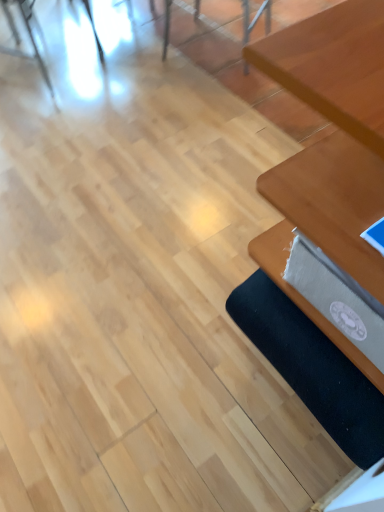
Question: Is wooden chair at upper center, which ranks as the first chair in right-to-left order, closer to camera compared to metallic silver chair at upper left, which is the 1th chair from left to right?

Choices:
 (A) yes
 (B) no

Answer: (B)

Question: Does wooden chair at upper center, which is counted as the 2th chair, starting from the left, have a lesser width compared to metallic silver chair at upper left, which is the second chair from right to left?

Choices:
 (A) yes
 (B) no

Answer: (B)

Question: Could metallic silver chair at upper left, which is the second chair from right to left, be considered to be inside wooden chair at upper center, which is counted as the 2th chair, starting from the left?

Choices:
 (A) no
 (B) yes

Answer: (A)

Question: From the image's perspective, is wooden chair at upper center, which ranks as the first chair in right-to-left order, located beneath metallic silver chair at upper left, which is the second chair from right to left?

Choices:
 (A) yes
 (B) no

Answer: (B)

Question: Is wooden chair at upper center, which ranks as the first chair in right-to-left order, at the left side of metallic silver chair at upper left, which is the 1th chair from left to right?

Choices:
 (A) no
 (B) yes

Answer: (A)

Question: From the image's perspective, is metallic silver chair at upper left, which is the second chair from right to left, above or below black fabric yoga mat at lower right?

Choices:
 (A) above
 (B) below

Answer: (A)

Question: Relative to black fabric yoga mat at lower right, is metallic silver chair at upper left, which is the 1th chair from left to right, in front or behind?

Choices:
 (A) behind
 (B) front

Answer: (A)

Question: Does point (28, 16) appear closer or farther from the camera than point (337, 378)?

Choices:
 (A) closer
 (B) farther

Answer: (B)

Question: Which is correct: metallic silver chair at upper left, which is the 1th chair from left to right, is inside black fabric yoga mat at lower right, or outside of it?

Choices:
 (A) inside
 (B) outside

Answer: (B)

Question: Is wooden chair at upper center, which is counted as the 2th chair, starting from the left, situated inside wooden table at right or outside?

Choices:
 (A) outside
 (B) inside

Answer: (A)

Question: Looking at the image, does wooden chair at upper center, which ranks as the first chair in right-to-left order, seem bigger or smaller compared to wooden table at right?

Choices:
 (A) big
 (B) small

Answer: (B)

Question: From a real-world perspective, relative to wooden table at right, is wooden chair at upper center, which ranks as the first chair in right-to-left order, vertically above or below?

Choices:
 (A) above
 (B) below

Answer: (B)

Question: Considering the positions of point (163, 16) and point (359, 364), is point (163, 16) closer or farther from the camera than point (359, 364)?

Choices:
 (A) farther
 (B) closer

Answer: (A)

Question: From the image's perspective, is wooden table at right located above or below metallic silver chair at upper left, which is the 1th chair from left to right?

Choices:
 (A) below
 (B) above

Answer: (A)

Question: Is wooden table at right in front of or behind metallic silver chair at upper left, which is the 1th chair from left to right, in the image?

Choices:
 (A) front
 (B) behind

Answer: (A)